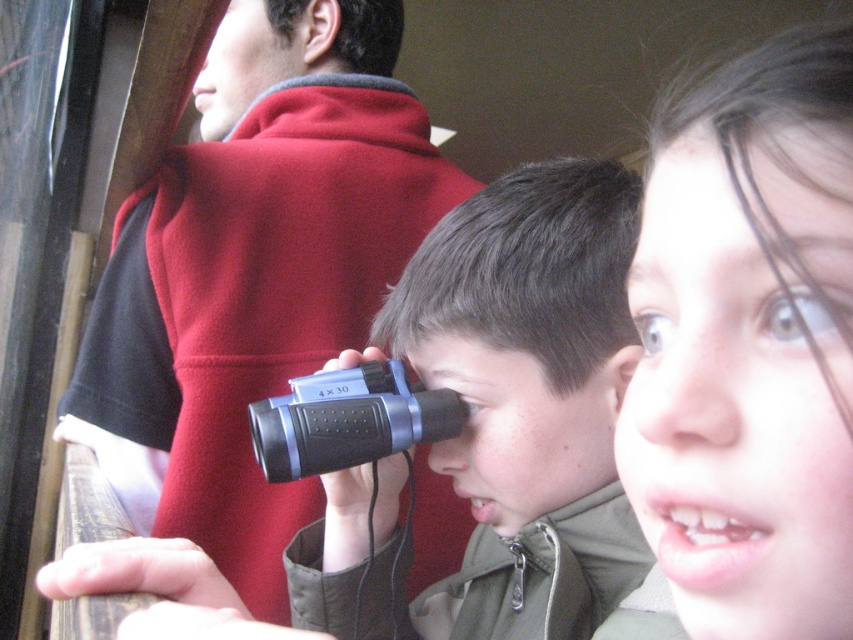
Is red fleece jacket at upper center taller than smooth skin face at upper right?

Yes.

Does red fleece jacket at upper center appear over smooth skin face at upper right?

Yes.

Who is more forward, (x=328, y=166) or (x=659, y=168)?

Point (x=659, y=168) is in front.

You are a GUI agent. You are given a task and a screenshot of the screen. Output one action in this format:
    pyautogui.click(x=<x>, y=<y>)
    Task: Click on the red fleece jacket at upper center
    This screenshot has height=640, width=853.
    Given the screenshot: What is the action you would take?
    pyautogui.click(x=254, y=272)

Who is lower down, smooth skin face at upper right or blue plastic binoculars at center?

blue plastic binoculars at center is below.

Is point (677, 572) more distant than point (352, 480)?

No, it is not.

This screenshot has height=640, width=853. In order to click on smooth skin face at upper right in this screenshot , I will do `click(747, 346)`.

Which is behind, point (244, 534) or point (376, 365)?

Point (244, 534)

Is red fleece jacket at upper center bigger than black plastic binoculars at center?

Yes, red fleece jacket at upper center is bigger than black plastic binoculars at center.

Is point (206, 122) in front of point (310, 403)?

No, it is behind (310, 403).

Identify the location of red fleece jacket at upper center. The height and width of the screenshot is (640, 853). (254, 272).